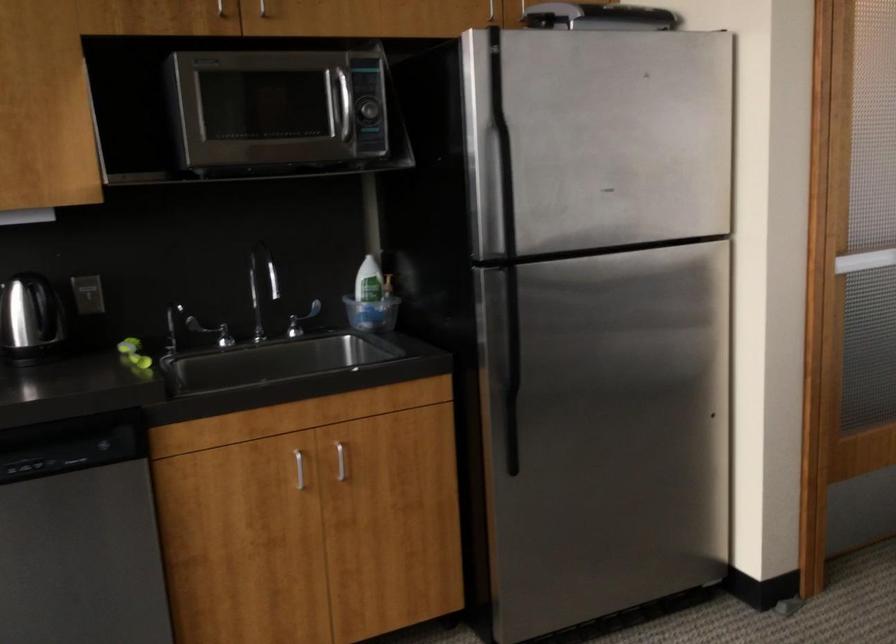
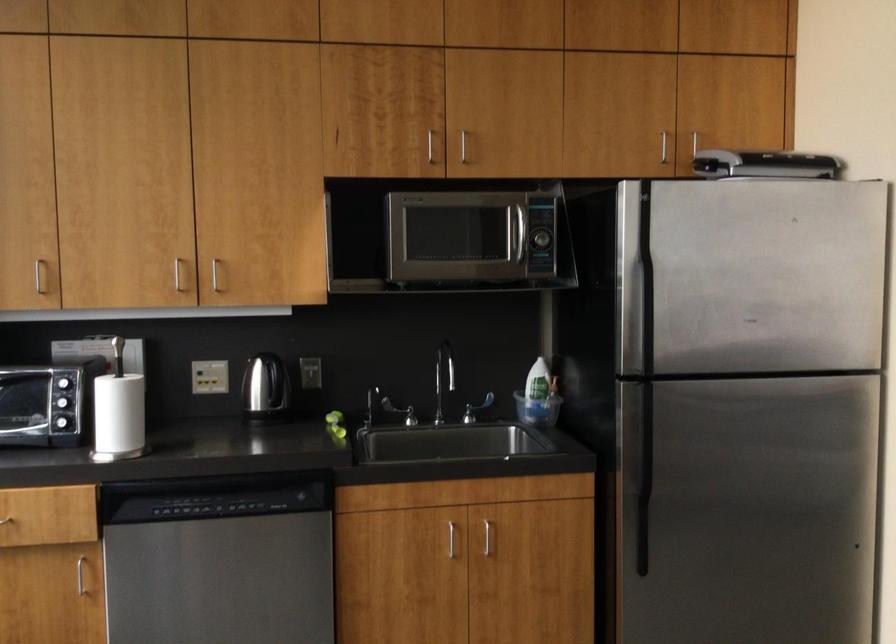
Question: The camera is either moving clockwise (left) or counter-clockwise (right) around the object. The first image is from the beginning of the video and the second image is from the end. Is the camera moving left or right when shooting the video?

Choices:
 (A) Left
 (B) Right

Answer: (B)